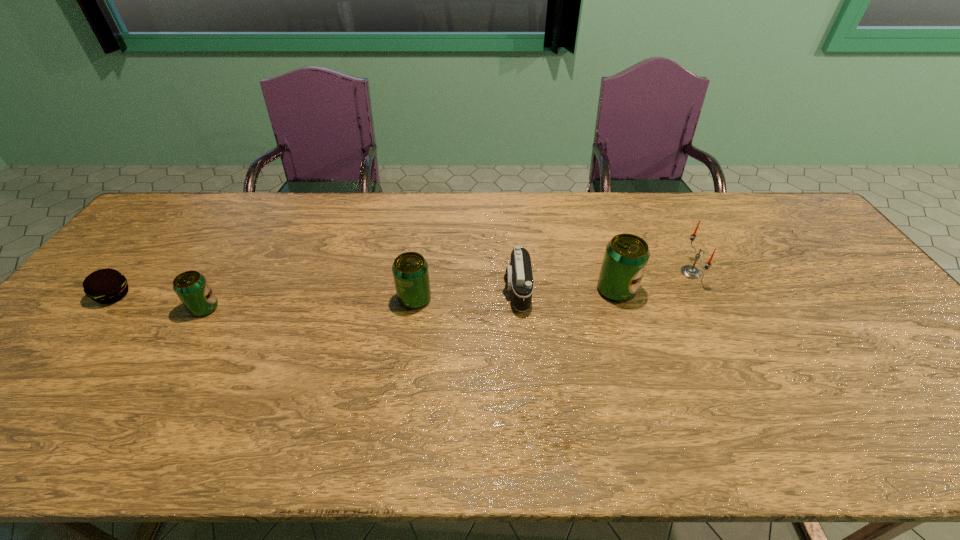
Where is `free space located on the right of the leftmost beer can`? free space located on the right of the leftmost beer can is located at coordinates (241, 308).

The width and height of the screenshot is (960, 540). Find the location of `vacant region located 0.310m on the back of the second shortest beer can`. vacant region located 0.310m on the back of the second shortest beer can is located at coordinates (426, 221).

Find the location of a particular element. Image resolution: width=960 pixels, height=540 pixels. free space located 0.190m on the left of the tallest beer can is located at coordinates (529, 290).

Locate an element on the screen. vacant region located 0.230m on the back of the shortest object is located at coordinates (165, 233).

In order to click on free spot located 0.330m on the front-facing side of the candle in this screenshot , I will do `click(568, 272)`.

Where is `vacant point located on the front-facing side of the candle`? vacant point located on the front-facing side of the candle is located at coordinates (643, 272).

You are a GUI agent. You are given a task and a screenshot of the screen. Output one action in this format:
    pyautogui.click(x=<x>, y=<y>)
    Task: Click on the vacant space located on the front-facing side of the candle
    
    Given the screenshot: What is the action you would take?
    pyautogui.click(x=548, y=272)

At what (x,y) coordinates should I click in order to perform the action: click on vacant region located on the front lens of the fourth object from left to right. Please return your answer as a coordinate pair (x, y). The image size is (960, 540). Looking at the image, I should click on (393, 291).

Locate an element on the screen. vacant position located 0.110m on the front lens of the fourth object from left to right is located at coordinates (464, 291).

Where is `vacant area situated 0.230m on the front lens of the fourth object from left to right`? Image resolution: width=960 pixels, height=540 pixels. vacant area situated 0.230m on the front lens of the fourth object from left to right is located at coordinates coord(420,291).